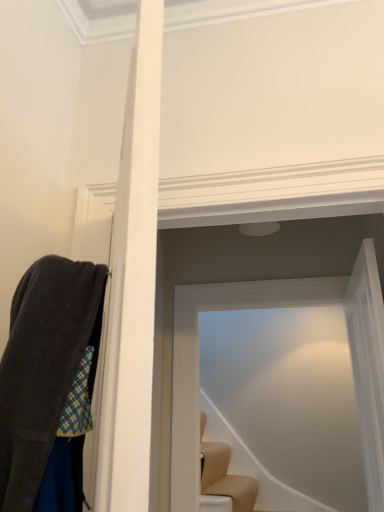
Question: Which direction should I rotate to face transparent glass door at upper center, which is counted as the 2th glass door, starting from the back, — up or down?

Choices:
 (A) down
 (B) up

Answer: (A)

Question: Is transparent glass door at upper center, the first glass door positioned from the front, next to transparent glass door at center, the 1th glass door viewed from the back?

Choices:
 (A) no
 (B) yes

Answer: (A)

Question: Is transparent glass door at center, the 1th glass door viewed from the back, located within transparent glass door at upper center, the first glass door positioned from the front?

Choices:
 (A) no
 (B) yes

Answer: (A)

Question: Is the position of transparent glass door at upper center, the first glass door positioned from the front, less distant than that of transparent glass door at center, acting as the second glass door starting from the front?

Choices:
 (A) no
 (B) yes

Answer: (B)

Question: Is transparent glass door at upper center, the first glass door positioned from the front, aimed at transparent glass door at center, the 1th glass door viewed from the back?

Choices:
 (A) no
 (B) yes

Answer: (B)

Question: From a real-world perspective, is transparent glass door at upper center, the first glass door positioned from the front, located beneath transparent glass door at center, the 1th glass door viewed from the back?

Choices:
 (A) yes
 (B) no

Answer: (A)

Question: Is transparent glass door at upper center, which is counted as the 2th glass door, starting from the back, to the right of transparent glass door at center, acting as the second glass door starting from the front, from the viewer's perspective?

Choices:
 (A) no
 (B) yes

Answer: (B)

Question: Is transparent glass door at center, acting as the second glass door starting from the front, wider than transparent glass door at upper center, the first glass door positioned from the front?

Choices:
 (A) yes
 (B) no

Answer: (B)

Question: From the image's perspective, does transparent glass door at center, acting as the second glass door starting from the front, appear higher than transparent glass door at upper center, which is counted as the 2th glass door, starting from the back?

Choices:
 (A) no
 (B) yes

Answer: (A)

Question: Would you consider transparent glass door at center, the 1th glass door viewed from the back, to be distant from transparent glass door at upper center, the first glass door positioned from the front?

Choices:
 (A) no
 (B) yes

Answer: (A)

Question: From the image's perspective, does transparent glass door at center, acting as the second glass door starting from the front, appear lower than transparent glass door at upper center, the first glass door positioned from the front?

Choices:
 (A) yes
 (B) no

Answer: (A)

Question: From a real-world perspective, is transparent glass door at center, the 1th glass door viewed from the back, positioned over transparent glass door at upper center, the first glass door positioned from the front, based on gravity?

Choices:
 (A) no
 (B) yes

Answer: (B)

Question: Is transparent glass door at center, the 1th glass door viewed from the back, smaller than transparent glass door at upper center, which is counted as the 2th glass door, starting from the back?

Choices:
 (A) no
 (B) yes

Answer: (B)

Question: In the image, is transparent glass door at upper center, which is counted as the 2th glass door, starting from the back, on the left side or the right side of transparent glass door at center, the 1th glass door viewed from the back?

Choices:
 (A) right
 (B) left

Answer: (A)